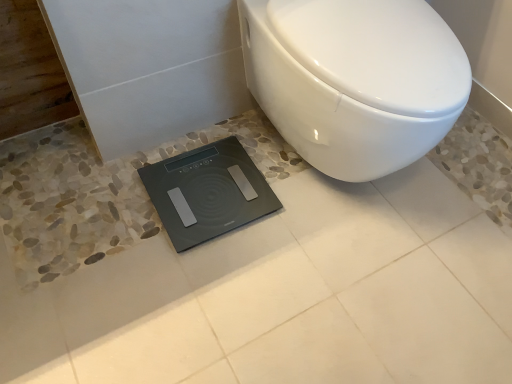
Question: Is white glossy toilet at center wider or thinner than black glass scale at lower center?

Choices:
 (A) wide
 (B) thin

Answer: (A)

Question: Is white glossy toilet at center situated inside black glass scale at lower center or outside?

Choices:
 (A) inside
 (B) outside

Answer: (B)

Question: Considering their positions, is white glossy toilet at center located in front of or behind black glass scale at lower center?

Choices:
 (A) front
 (B) behind

Answer: (A)

Question: Based on their positions, is black glass scale at lower center located to the left or right of white glossy toilet at center?

Choices:
 (A) right
 (B) left

Answer: (B)

Question: From a real-world perspective, is black glass scale at lower center above or below white glossy toilet at center?

Choices:
 (A) below
 (B) above

Answer: (A)

Question: From the image's perspective, is black glass scale at lower center above or below white glossy toilet at center?

Choices:
 (A) above
 (B) below

Answer: (B)

Question: Considering their positions, is black glass scale at lower center located in front of or behind white glossy toilet at center?

Choices:
 (A) front
 (B) behind

Answer: (B)